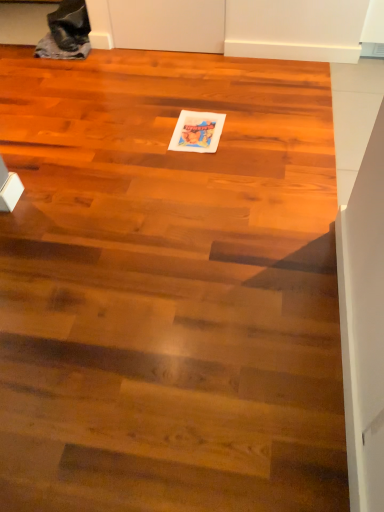
Where is `free space in front of white paper at center`? free space in front of white paper at center is located at coordinates (200, 166).